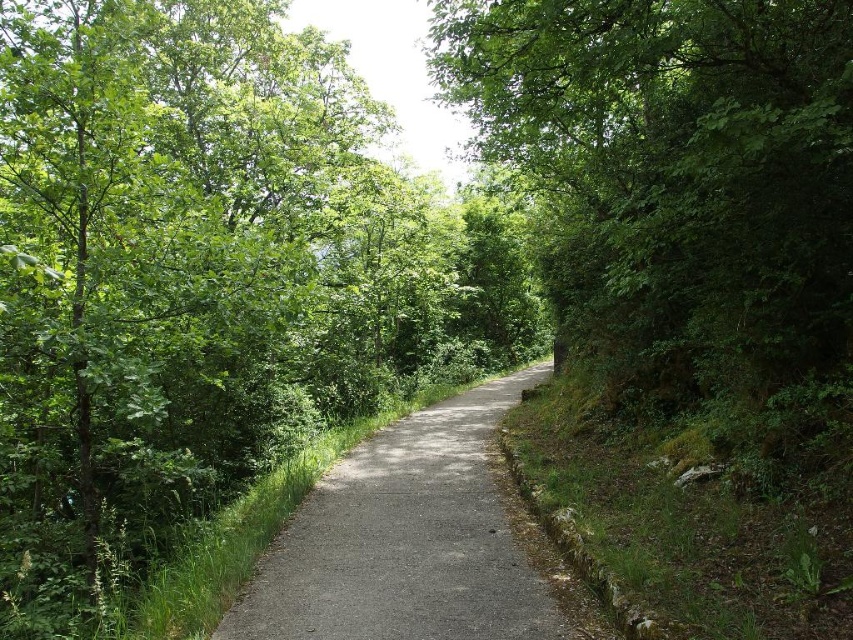
Question: Which object appears farthest from the camera in this image?

Choices:
 (A) gray asphalt trail at center
 (B) green leafy tree at center

Answer: (A)

Question: Is green leafy tree at center above gray asphalt trail at center?

Choices:
 (A) no
 (B) yes

Answer: (B)

Question: Which of the following is the farthest from the observer?

Choices:
 (A) click(746, 132)
 (B) click(447, 465)

Answer: (B)

Question: Is green leafy tree at center to the right of gray asphalt trail at center from the viewer's perspective?

Choices:
 (A) yes
 (B) no

Answer: (A)

Question: Which point appears closest to the camera in this image?

Choices:
 (A) (634, 298)
 (B) (462, 513)

Answer: (B)

Question: Is green leafy tree at center wider than gray asphalt trail at center?

Choices:
 (A) yes
 (B) no

Answer: (A)